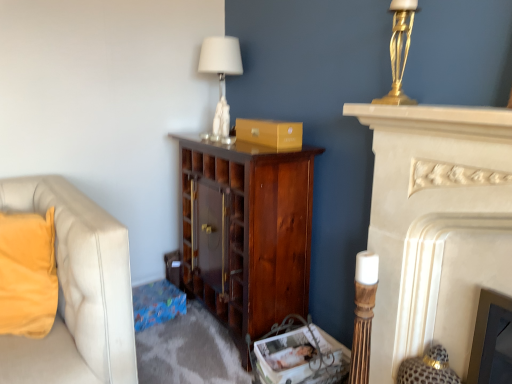
Question: From the image's perspective, would you say dark wood cabinet at center is positioned over matte gold cardboard box at center?

Choices:
 (A) yes
 (B) no

Answer: (B)

Question: Considering the relative sizes of dark wood cabinet at center and matte gold cardboard box at center in the image provided, is dark wood cabinet at center smaller than matte gold cardboard box at center?

Choices:
 (A) yes
 (B) no

Answer: (B)

Question: Is dark wood cabinet at center wider than matte gold cardboard box at center?

Choices:
 (A) yes
 (B) no

Answer: (A)

Question: Can we say dark wood cabinet at center lies outside matte gold cardboard box at center?

Choices:
 (A) no
 (B) yes

Answer: (B)

Question: Does dark wood cabinet at center have a lesser width compared to matte gold cardboard box at center?

Choices:
 (A) no
 (B) yes

Answer: (A)

Question: Is velvet yellow pillow at left wider or thinner than gold metallic lamp at upper right?

Choices:
 (A) wide
 (B) thin

Answer: (A)

Question: From the image's perspective, relative to gold metallic lamp at upper right, is velvet yellow pillow at left above or below?

Choices:
 (A) below
 (B) above

Answer: (A)

Question: Which is correct: velvet yellow pillow at left is inside gold metallic lamp at upper right, or outside of it?

Choices:
 (A) inside
 (B) outside

Answer: (B)

Question: Would you say velvet yellow pillow at left is to the left or to the right of gold metallic lamp at upper right in the picture?

Choices:
 (A) left
 (B) right

Answer: (A)

Question: Is matte gold cardboard box at center bigger or smaller than gold metallic lamp at upper right?

Choices:
 (A) small
 (B) big

Answer: (B)

Question: From a real-world perspective, is matte gold cardboard box at center above or below gold metallic lamp at upper right?

Choices:
 (A) above
 (B) below

Answer: (B)

Question: Looking at their shapes, would you say matte gold cardboard box at center is wider or thinner than gold metallic lamp at upper right?

Choices:
 (A) thin
 (B) wide

Answer: (B)

Question: In the image, is matte gold cardboard box at center positioned in front of or behind gold metallic lamp at upper right?

Choices:
 (A) behind
 (B) front

Answer: (A)

Question: Considering the positions of point (280, 203) and point (397, 59), is point (280, 203) closer or farther from the camera than point (397, 59)?

Choices:
 (A) closer
 (B) farther

Answer: (B)

Question: Is dark wood cabinet at center taller or shorter than gold metallic lamp at upper right?

Choices:
 (A) short
 (B) tall

Answer: (B)